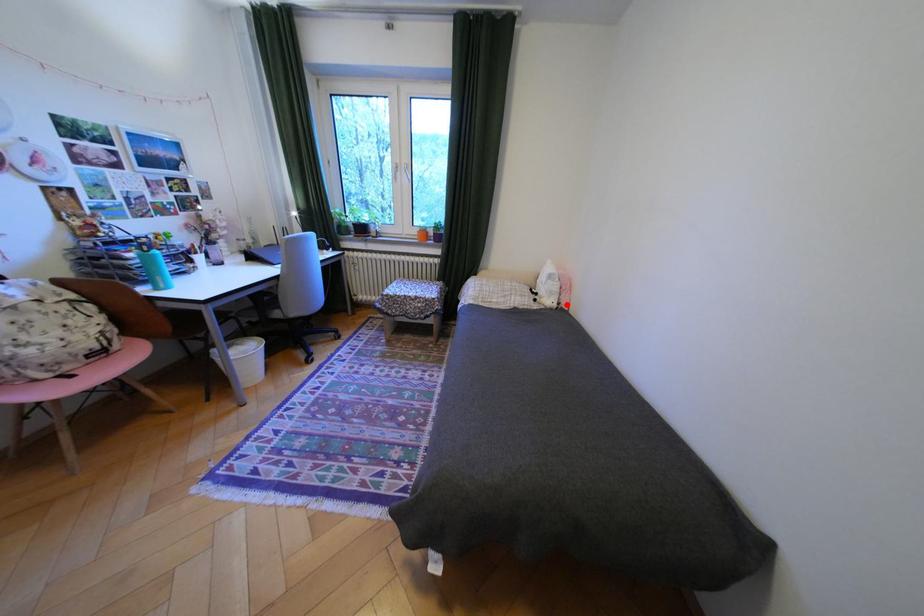
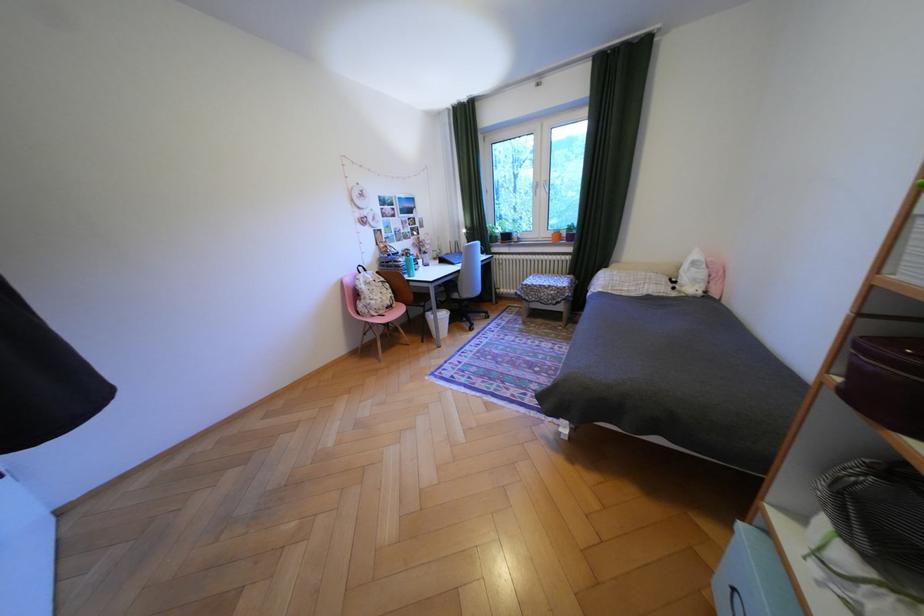
In the second image, find the point that corresponds to the highlighted location in the first image.

(712, 293)